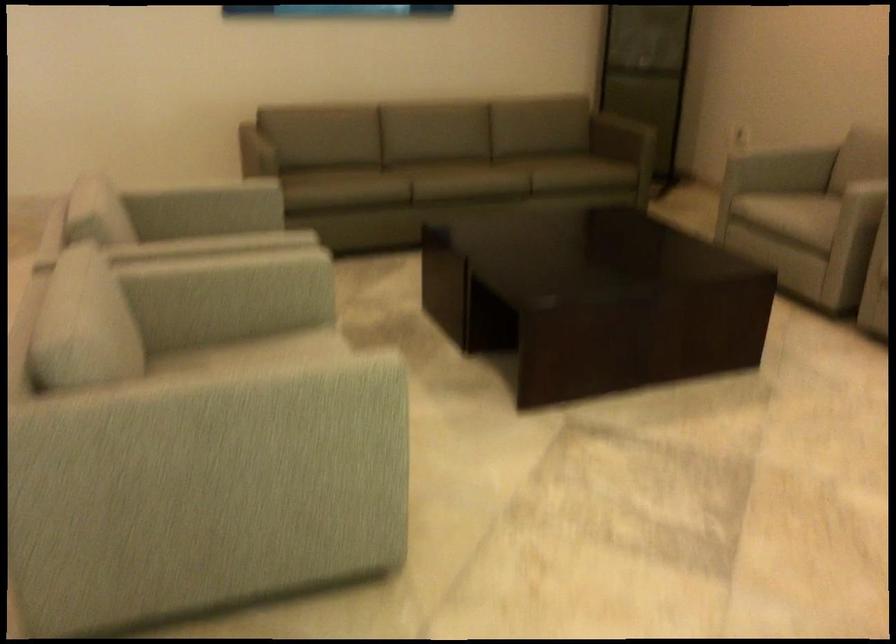
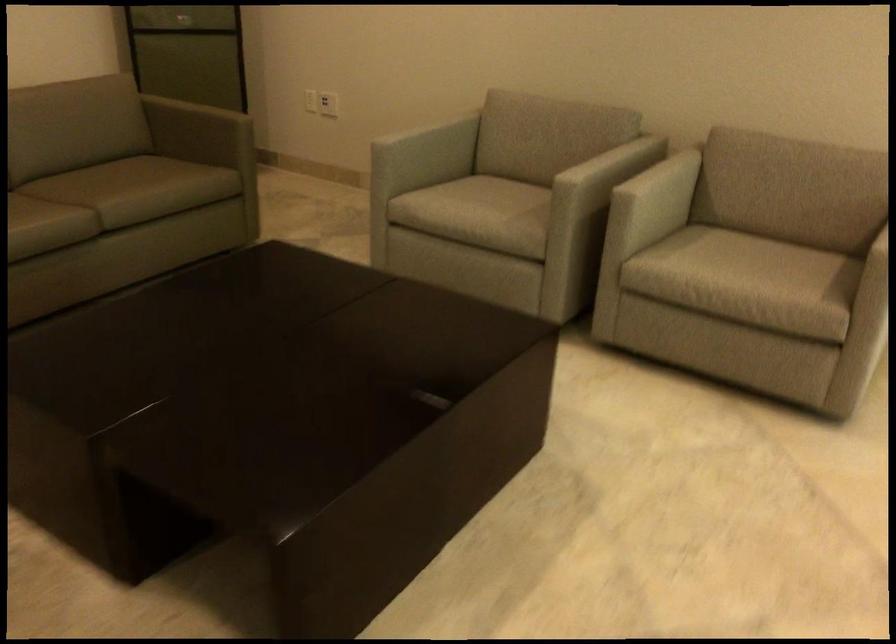
Locate, in the second image, the point that corresponds to pixel 721 138 in the first image.

(328, 104)